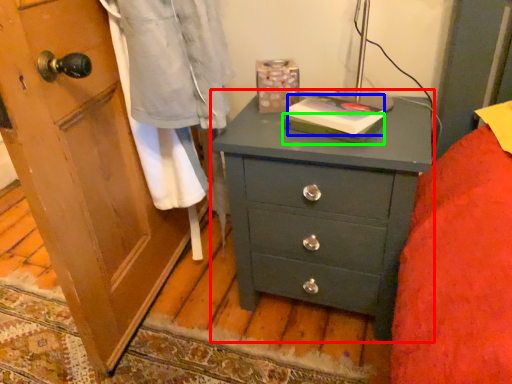
Question: Considering the real-world distances, which object is farthest from chest of drawers (highlighted by a red box)? book (highlighted by a blue box) or book (highlighted by a green box)?

Choices:
 (A) book
 (B) book

Answer: (B)